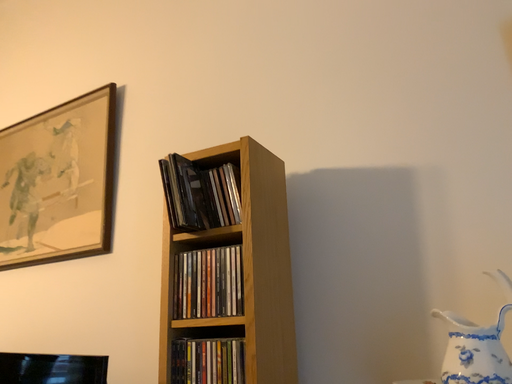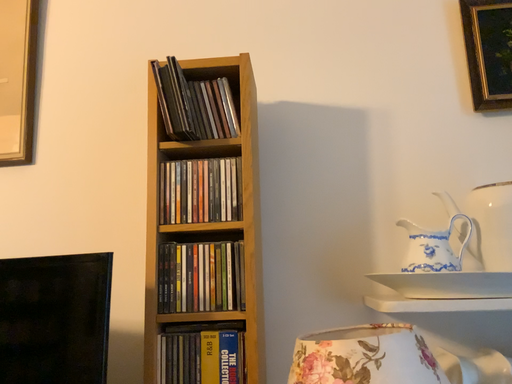
Question: Which way did the camera rotate in the video?

Choices:
 (A) rotated downward
 (B) rotated upward

Answer: (A)